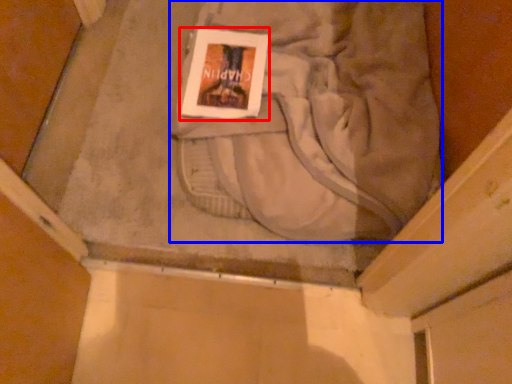
Question: Which object appears closest to the camera in this image, paperback book (highlighted by a red box) or sweat pant (highlighted by a blue box)?

Choices:
 (A) paperback book
 (B) sweat pant

Answer: (B)